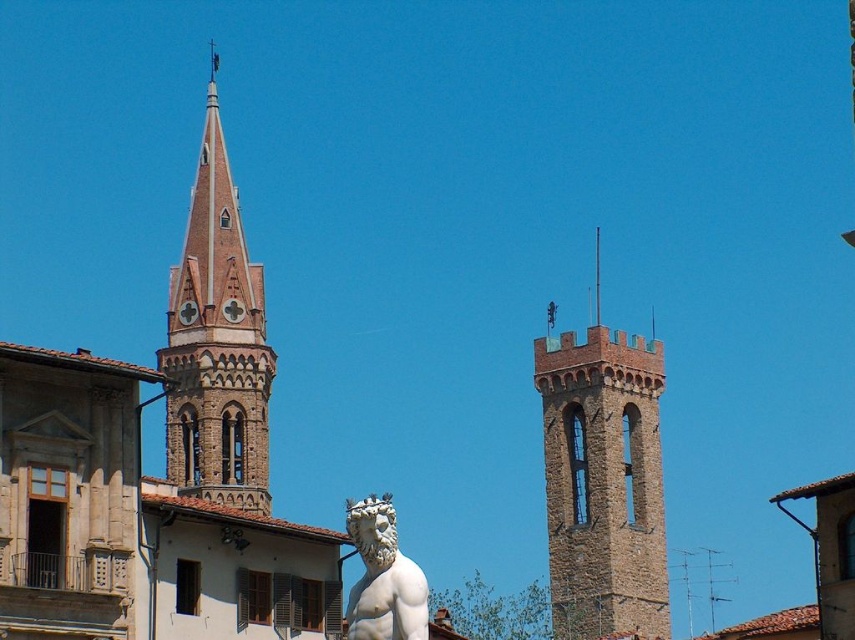
You are standing in front of the two towers and want to place a small flag at the point marked by coordinates point (603, 481). Which tower should you climb to reach that point?

The point (603, 481) is on the brown stone tower at upper right, so you should climb the brown stone tower at upper right to reach that point.

You are an architect designing a new garden layout. You need to place a new flower bed between the brown stone tower at upper right and the white marble statue at center. Considering their widths, which side of the flower bed should be wider to accommodate the space properly?

The brown stone tower at upper right is wider than the white marble statue at center, so the side of the flower bed near the brown stone tower at upper right should be wider to match its larger width.

What is the 2D coordinate of the brown stone spire at upper left in the image?

The brown stone spire at upper left is located at the 2D coordinate point of (216,342).